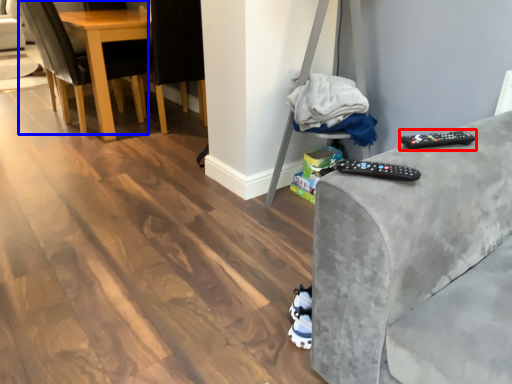
Question: Which object appears closest to the camera in this image, remote (highlighted by a red box) or chair (highlighted by a blue box)?

Choices:
 (A) remote
 (B) chair

Answer: (A)